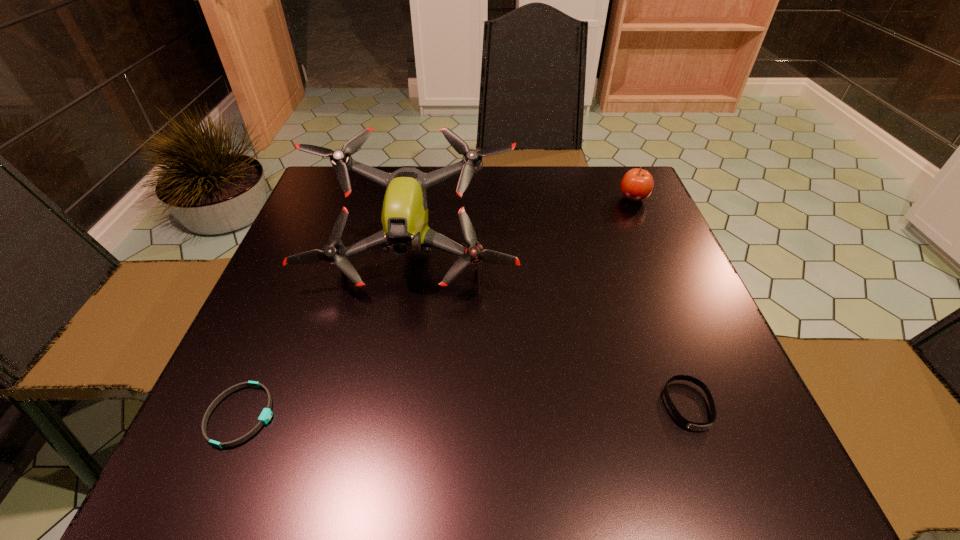
Where is `drone`? drone is located at coordinates (404, 218).

Image resolution: width=960 pixels, height=540 pixels. Identify the location of the tallest object. (404, 218).

Image resolution: width=960 pixels, height=540 pixels. I want to click on apple, so click(637, 184).

Identify the location of the third shortest object. The width and height of the screenshot is (960, 540). (637, 184).

Where is `the right wristband`? Image resolution: width=960 pixels, height=540 pixels. the right wristband is located at coordinates pyautogui.click(x=695, y=426).

The height and width of the screenshot is (540, 960). Find the location of `the taller wristband`. the taller wristband is located at coordinates (695, 426).

This screenshot has height=540, width=960. In order to click on the left wristband in this screenshot , I will do `click(266, 414)`.

Locate an element on the screen. The image size is (960, 540). the shorter wristband is located at coordinates (266, 414).

Find the location of a particular element. The width and height of the screenshot is (960, 540). vacant space located 0.270m on the front-facing side of the tallest object is located at coordinates (383, 428).

Where is `free space located on the front of the second tallest object`? free space located on the front of the second tallest object is located at coordinates (646, 227).